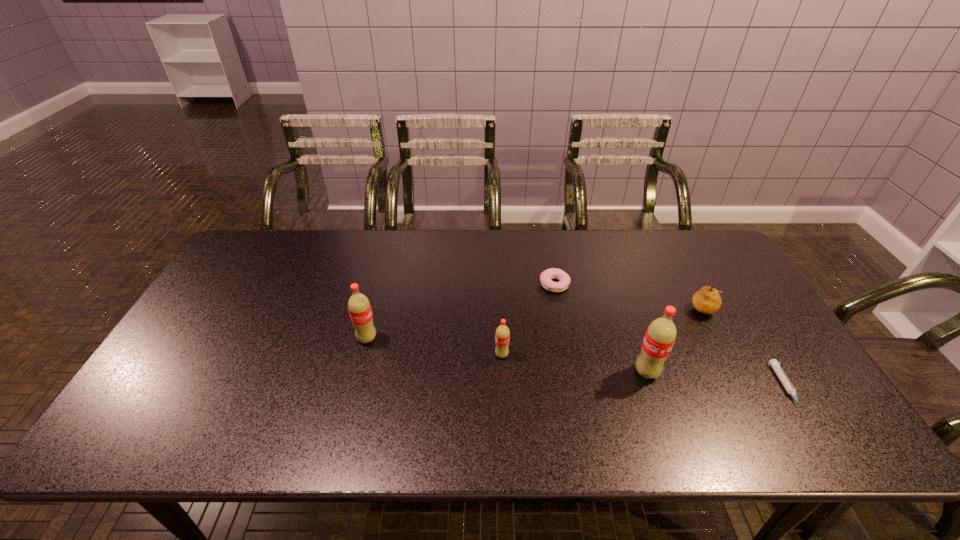
You are a GUI agent. You are given a task and a screenshot of the screen. Output one action in this format:
    pyautogui.click(x=<x>, y=<y>)
    Task: Click on the shortest object
    
    Given the screenshot: What is the action you would take?
    pyautogui.click(x=775, y=364)

Identify the location of the rightmost object. pos(775,364).

At what (x,y) coordinates should I click in order to perform the action: click on vacant space located 0.220m on the left of the second shortest soda. Please return your answer as a coordinate pair (x, y). Looking at the image, I should click on (276, 339).

Image resolution: width=960 pixels, height=540 pixels. What are the coordinates of `vacant area situated on the left of the second object from left to right` in the screenshot? It's located at (400, 355).

Where is `vacant space located 0.120m on the left of the nearest soda`? This screenshot has height=540, width=960. vacant space located 0.120m on the left of the nearest soda is located at coordinates coord(587,372).

What are the coordinates of `vacant space located 0.100m on the right of the pear` in the screenshot? It's located at (756, 310).

This screenshot has width=960, height=540. I want to click on vacant space located on the back of the farthest object, so click(x=549, y=258).

In order to click on soda that is at the near edge in this screenshot , I will do `click(660, 336)`.

Identify the location of syringe located at the near edge. (775, 364).

Where is `pear positioned at the right edge`? pear positioned at the right edge is located at coordinates (707, 300).